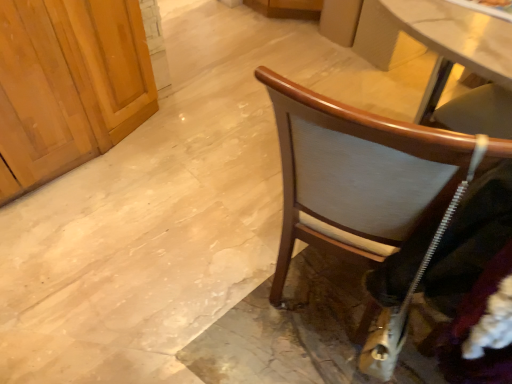
Question: From the image's perspective, is wooden chair at right on top of velvet black jacket at right?

Choices:
 (A) yes
 (B) no

Answer: (A)

Question: Is wooden chair at right directly adjacent to velvet black jacket at right?

Choices:
 (A) yes
 (B) no

Answer: (B)

Question: From a real-world perspective, is wooden chair at right physically above velvet black jacket at right?

Choices:
 (A) no
 (B) yes

Answer: (A)

Question: Is wooden chair at right at the left side of velvet black jacket at right?

Choices:
 (A) yes
 (B) no

Answer: (A)

Question: Can you confirm if wooden chair at right is positioned to the right of velvet black jacket at right?

Choices:
 (A) yes
 (B) no

Answer: (B)

Question: Does wooden chair at right have a smaller size compared to velvet black jacket at right?

Choices:
 (A) yes
 (B) no

Answer: (B)

Question: Is velvet black jacket at right bigger than wooden chair at right?

Choices:
 (A) yes
 (B) no

Answer: (B)

Question: From a real-world perspective, is velvet black jacket at right located higher than wooden chair at right?

Choices:
 (A) yes
 (B) no

Answer: (A)

Question: Is velvet black jacket at right taller than wooden chair at right?

Choices:
 (A) yes
 (B) no

Answer: (A)

Question: Is velvet black jacket at right positioned behind wooden chair at right?

Choices:
 (A) no
 (B) yes

Answer: (A)

Question: Is velvet black jacket at right in contact with wooden chair at right?

Choices:
 (A) yes
 (B) no

Answer: (B)

Question: Are velvet black jacket at right and wooden chair at right far apart?

Choices:
 (A) yes
 (B) no

Answer: (B)

Question: Considering the positions of wooden chair at right and velvet black jacket at right in the image, is wooden chair at right bigger or smaller than velvet black jacket at right?

Choices:
 (A) big
 (B) small

Answer: (A)